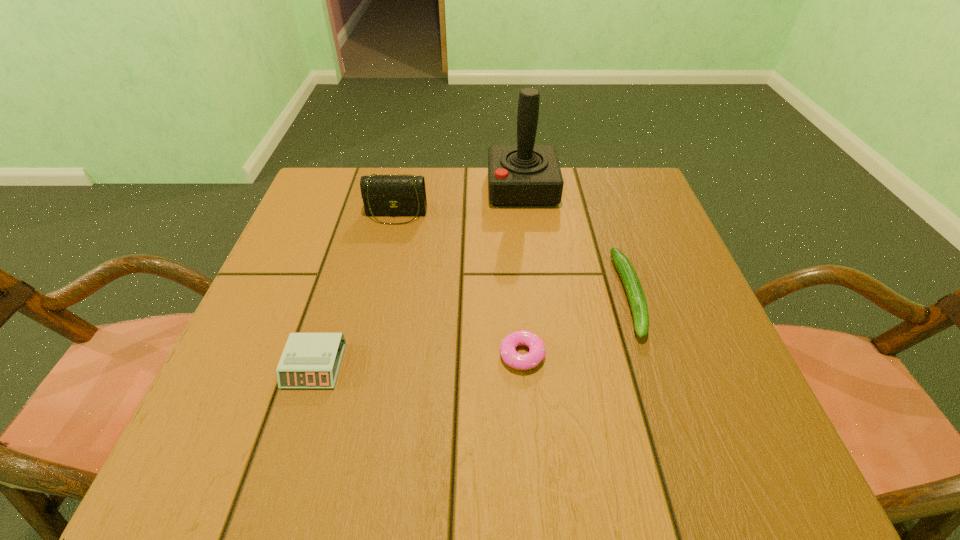
Identify the location of vacant space at the right edge of the desktop. This screenshot has width=960, height=540. (678, 280).

The width and height of the screenshot is (960, 540). I want to click on vacant space at the far left corner, so click(325, 200).

This screenshot has width=960, height=540. In the image, there is a desktop. What are the coordinates of `vacant space at the near left corner` in the screenshot? It's located at pyautogui.click(x=289, y=464).

In the image, there is a desktop. Where is `vacant space at the far right corner`? vacant space at the far right corner is located at coordinates (626, 169).

This screenshot has height=540, width=960. In order to click on free point at the near right corner in this screenshot , I will do `click(702, 431)`.

The height and width of the screenshot is (540, 960). Identify the location of vacant area between the clutch bag and the rightmost object. (513, 254).

This screenshot has height=540, width=960. In order to click on vacant area that lies between the doughnut and the alarm clock in this screenshot , I will do `click(419, 360)`.

The image size is (960, 540). I want to click on empty space between the doughnut and the alarm clock, so click(419, 360).

Identify the location of free point between the zucchini and the alarm clock. This screenshot has width=960, height=540. (472, 330).

Image resolution: width=960 pixels, height=540 pixels. Find the location of `vacant space that's between the fourth shortest object and the alarm clock`. vacant space that's between the fourth shortest object and the alarm clock is located at coordinates coord(355,289).